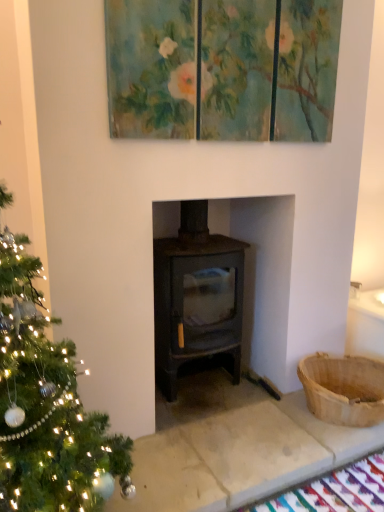
The width and height of the screenshot is (384, 512). What are the coordinates of `free space to the left of brown woven basket at right` in the screenshot? It's located at (268, 434).